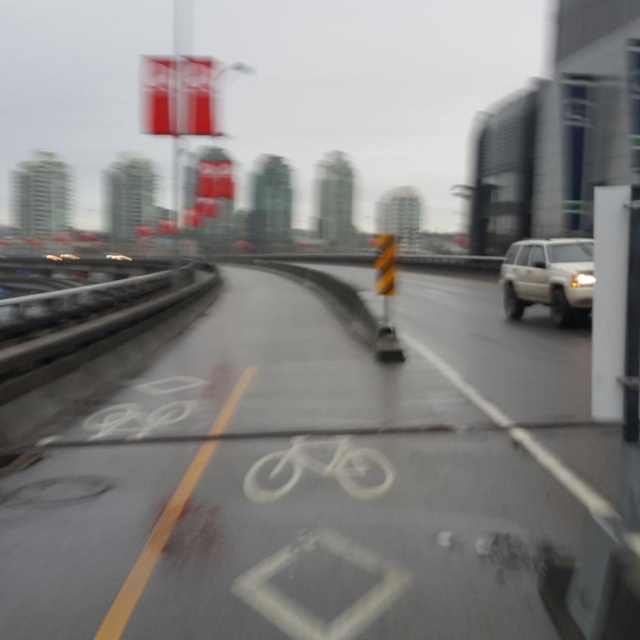
You are driving a car that is 6 feet wide. You need to pass through the area where both the white painted bicycle lane at center and the white matte bicycle at center are located. Can your car fit through the space between them without touching either the lane or the bicycle?

The white painted bicycle lane at center and the white matte bicycle at center are 8.19 feet apart from each other. Since your car is 6 feet wide, it can fit through the space between them as 8.19 feet is wider than 6 feet.

Based on the photo, you are driving a car that is 4.5 meters long and need to pass through the area where the white matte bicycle at center and the yellow striped traffic cone at center are located. Can your car fit between them without touching either?

The distance between the white matte bicycle at center and the yellow striped traffic cone at center is 6.85 meters. Since your car is 4.5 meters long, there is enough space for the car to pass through without touching either object.